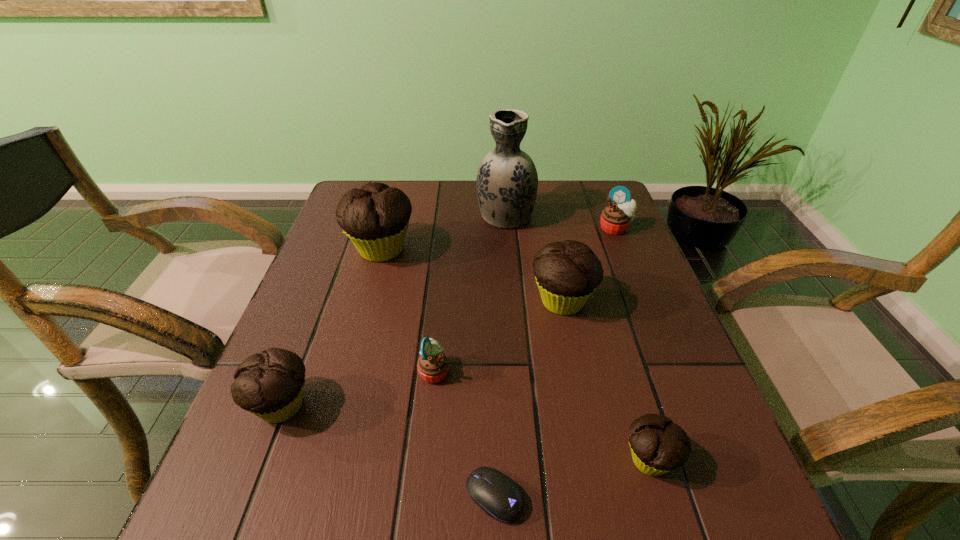
Locate an element on the screen. Image resolution: width=960 pixels, height=540 pixels. unoccupied position between the blue vase and the tallest muffin is located at coordinates [x=444, y=232].

The width and height of the screenshot is (960, 540). Identify the location of empty location between the smallest chocolate muffin and the third tallest object. (607, 381).

You are a GUI agent. You are given a task and a screenshot of the screen. Output one action in this format:
    pyautogui.click(x=<x>, y=<y>)
    Task: Click on the empty space that is in between the shortest object and the third farthest muffin
    The height and width of the screenshot is (540, 960).
    Given the screenshot: What is the action you would take?
    pyautogui.click(x=528, y=399)

Locate an element on the screen. Image resolution: width=960 pixels, height=540 pixels. free space between the smallest chocolate muffin and the second smallest chocolate muffin is located at coordinates coord(466,433).

Find the location of a particular element. vacant space that's between the black computer mouse and the second smallest chocolate muffin is located at coordinates (388, 451).

The height and width of the screenshot is (540, 960). I want to click on unoccupied position between the tallest object and the bigger pink muffin, so click(x=561, y=221).

You are a GUI agent. You are given a task and a screenshot of the screen. Output one action in this format:
    pyautogui.click(x=<x>, y=<y>)
    Task: Click on the vacant space that is in between the rightmost muffin and the second smallest chocolate muffin
    Image resolution: width=960 pixels, height=540 pixels.
    Given the screenshot: What is the action you would take?
    pyautogui.click(x=448, y=317)

I want to click on vacant area that lies between the rightmost muffin and the second smallest chocolate muffin, so click(448, 317).

This screenshot has height=540, width=960. In order to click on the sixth closest object to the third tallest object in this screenshot , I will do `click(496, 494)`.

At what (x,y) coordinates should I click in order to perform the action: click on object that ranks as the third closest to the nearer pink muffin. Please return your answer as a coordinate pair (x, y). Looking at the image, I should click on (567, 273).